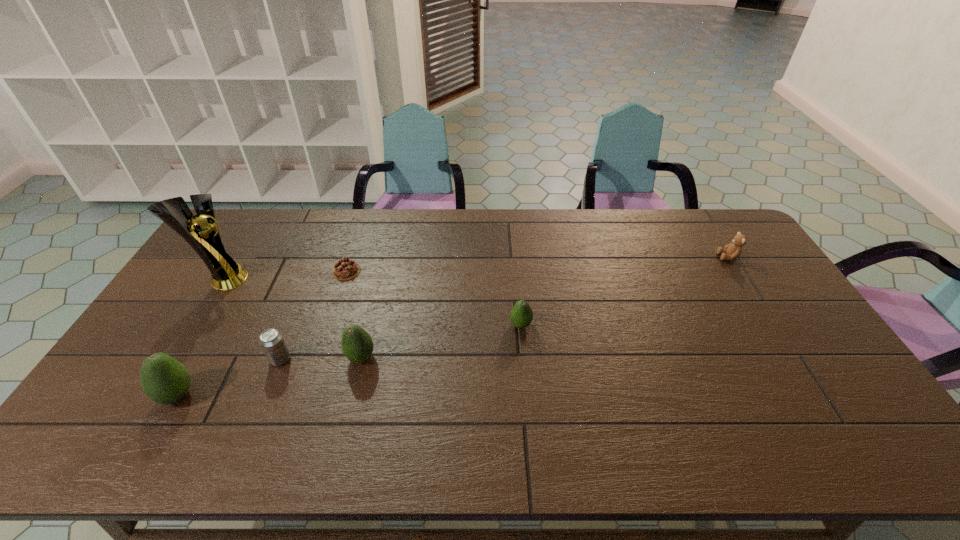
You are a GUI agent. You are given a task and a screenshot of the screen. Output one action in this format:
    pyautogui.click(x=<x>, y=<y>)
    Task: Click on the third object from left to right
    The image size is (960, 540).
    Given the screenshot: What is the action you would take?
    pyautogui.click(x=272, y=342)

In order to click on vacant region located on the back of the tallest avocado in this screenshot , I will do `click(201, 354)`.

Find the location of `vacant space located on the back of the second nearest avocado`. vacant space located on the back of the second nearest avocado is located at coordinates (376, 293).

The height and width of the screenshot is (540, 960). Find the location of `free space located on the right of the farthest avocado`. free space located on the right of the farthest avocado is located at coordinates (566, 325).

Identify the location of free spot located on the left of the shortest object. This screenshot has width=960, height=540. (302, 271).

Find the location of a particular element. The width and height of the screenshot is (960, 540). vacant space situated 0.160m on the front-facing side of the teddy bear is located at coordinates (672, 257).

Locate an element on the screen. This screenshot has width=960, height=540. vacant space situated on the front-facing side of the teddy bear is located at coordinates (x=637, y=257).

Identify the location of vacant space positioned on the front-facing side of the teddy bear. The image size is (960, 540). (686, 257).

Identify the location of blank area located at the front of the award, where the globe is visible. The height and width of the screenshot is (540, 960). (262, 279).

The image size is (960, 540). What are the coordinates of `blank space located on the right of the fifth object from right to left` in the screenshot? It's located at (313, 359).